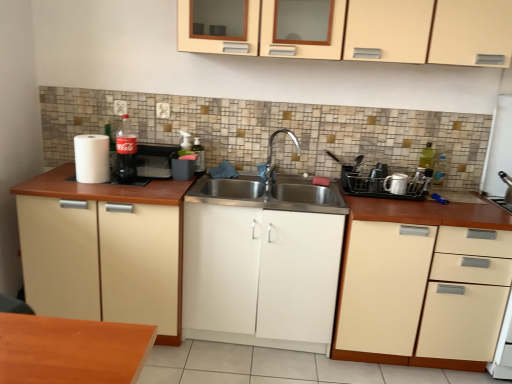
Describe the element at coordinates (271, 158) in the screenshot. The width and height of the screenshot is (512, 384). I see `polished stainless steel faucet at center` at that location.

The height and width of the screenshot is (384, 512). I want to click on white matte dish rack at center right, which appears as the 3th appliance when viewed from the right, so click(x=387, y=183).

What do you see at coordinates (396, 183) in the screenshot?
I see `white glossy mug at right, the first appliance from the right` at bounding box center [396, 183].

The width and height of the screenshot is (512, 384). What do you see at coordinates (103, 250) in the screenshot? I see `beige matte cabinet at left, acting as the 4th cabinetry starting from the right` at bounding box center [103, 250].

Measure the distance between white matte paper towel at left and camera.

The depth of white matte paper towel at left is 7.03 feet.

Identify the location of matte cream cabinet at upper center, the third cabinetry when ordered from left to right. This screenshot has height=384, width=512. (408, 32).

At what (x,y) coordinates should I click in order to perform the action: click on black plastic dish rack at right, which is the second appliance in right-to-left order. Please return your answer as a coordinate pair (x, y). This screenshot has height=384, width=512. Looking at the image, I should click on (377, 177).

Does matte glass coca-cola bottle at left, which is counted as the 2th bottle, starting from the back, have a larger size compared to white matte cabinet at center, the third cabinetry positioned from the right?

Actually, matte glass coca-cola bottle at left, which is counted as the 2th bottle, starting from the back, might be smaller than white matte cabinet at center, the third cabinetry positioned from the right.

From the picture: Is matte glass coca-cola bottle at left, arranged as the 1th bottle when viewed from the left, in front of or behind white matte cabinet at center, placed as the second cabinetry when sorted from left to right, in the image?

matte glass coca-cola bottle at left, arranged as the 1th bottle when viewed from the left, is behind white matte cabinet at center, placed as the second cabinetry when sorted from left to right.

Is white matte dish rack at center right, which appears as the 1th appliance when viewed from the left, oriented away from black plastic dish rack at right, which is the second appliance in left-to-right order?

That's right, white matte dish rack at center right, which appears as the 1th appliance when viewed from the left, is facing away from black plastic dish rack at right, which is the second appliance in left-to-right order.

Which is closer, (x=384, y=190) or (x=380, y=177)?

Point (x=384, y=190)

Which object is more forward, white matte dish rack at center right, which appears as the 1th appliance when viewed from the left, or black plastic dish rack at right, which is the second appliance in left-to-right order?

Positioned in front is white matte dish rack at center right, which appears as the 1th appliance when viewed from the left.

Is white matte dish rack at center right, which appears as the 1th appliance when viewed from the left, completely or partially outside of black plastic dish rack at right, which is the second appliance in left-to-right order?

white matte dish rack at center right, which appears as the 1th appliance when viewed from the left, lies outside black plastic dish rack at right, which is the second appliance in left-to-right order,'s area.

Considering the positions of objects beige matte cabinet at left, positioned as the 1th cabinetry in left-to-right order, and beige matte cabinet at right, placed as the first cabinetry when sorted from right to left, in the image provided, who is in front, beige matte cabinet at left, positioned as the 1th cabinetry in left-to-right order, or beige matte cabinet at right, placed as the first cabinetry when sorted from right to left,?

Positioned in front is beige matte cabinet at right, placed as the first cabinetry when sorted from right to left.

Looking at this image, considering the relative sizes of beige matte cabinet at left, positioned as the 1th cabinetry in left-to-right order, and beige matte cabinet at right, marked as the 4th cabinetry in a left-to-right arrangement, in the image provided, is beige matte cabinet at left, positioned as the 1th cabinetry in left-to-right order, taller than beige matte cabinet at right, marked as the 4th cabinetry in a left-to-right arrangement,?

Incorrect, the height of beige matte cabinet at left, positioned as the 1th cabinetry in left-to-right order, is not larger of that of beige matte cabinet at right, marked as the 4th cabinetry in a left-to-right arrangement.

Considering the positions of objects beige matte cabinet at left, acting as the 4th cabinetry starting from the right, and beige matte cabinet at right, placed as the first cabinetry when sorted from right to left, in the image provided, who is more to the left, beige matte cabinet at left, acting as the 4th cabinetry starting from the right, or beige matte cabinet at right, placed as the first cabinetry when sorted from right to left,?

From the viewer's perspective, beige matte cabinet at left, acting as the 4th cabinetry starting from the right, appears more on the left side.

Is polished stainless steel faucet at center positioned with its back to white matte paper towel at left?

That's not correct — polished stainless steel faucet at center is not looking away from white matte paper towel at left.

Is point (271, 151) closer to camera compared to point (105, 147)?

That is False.

Looking at this image, from a real-world perspective, is polished stainless steel faucet at center on white matte paper towel at left?

Indeed, from a real-world perspective, polished stainless steel faucet at center stands above white matte paper towel at left.

Which object is further away from the camera taking this photo, polished stainless steel faucet at center or white matte paper towel at left?

polished stainless steel faucet at center is more distant.

Which of these two, beige matte cabinet at left, acting as the 4th cabinetry starting from the right, or white glossy mug at right, the 3th appliance in the left-to-right sequence, is thinner?

white glossy mug at right, the 3th appliance in the left-to-right sequence, is thinner.

How many degrees apart are the facing directions of beige matte cabinet at left, acting as the 4th cabinetry starting from the right, and white glossy mug at right, the first appliance from the right?

There is a 7.26e-05-degree angle between the facing directions of beige matte cabinet at left, acting as the 4th cabinetry starting from the right, and white glossy mug at right, the first appliance from the right.

Would you consider beige matte cabinet at left, acting as the 4th cabinetry starting from the right, to be distant from white glossy mug at right, the 3th appliance in the left-to-right sequence?

Yes, beige matte cabinet at left, acting as the 4th cabinetry starting from the right, and white glossy mug at right, the 3th appliance in the left-to-right sequence, are located far from each other.

Does point (87, 192) appear closer or farther from the camera than point (392, 174)?

Point (87, 192) is closer to the camera than point (392, 174).

Considering the sizes of white matte cabinet at center, placed as the second cabinetry when sorted from left to right, and matte cream cabinet at upper center, the third cabinetry when ordered from left to right, in the image, is white matte cabinet at center, placed as the second cabinetry when sorted from left to right, taller or shorter than matte cream cabinet at upper center, the third cabinetry when ordered from left to right,?

In the image, white matte cabinet at center, placed as the second cabinetry when sorted from left to right, appears to be taller than matte cream cabinet at upper center, the third cabinetry when ordered from left to right.

Could you tell me if white matte cabinet at center, the third cabinetry positioned from the right, is facing matte cream cabinet at upper center, the third cabinetry when ordered from left to right?

No, white matte cabinet at center, the third cabinetry positioned from the right, is not aimed at matte cream cabinet at upper center, the third cabinetry when ordered from left to right.

Is point (290, 231) positioned after point (330, 56)?

Yes, point (290, 231) is behind point (330, 56).

Which is behind, white matte cabinet at center, the third cabinetry positioned from the right, or matte cream cabinet at upper center, acting as the second cabinetry starting from the right?

Positioned behind is white matte cabinet at center, the third cabinetry positioned from the right.

Between white matte dish rack at center right, which appears as the 1th appliance when viewed from the left, and translucent plastic soap dispenser at center, marked as the first bottle in a right-to-left arrangement, which one is positioned in front?

white matte dish rack at center right, which appears as the 1th appliance when viewed from the left, is closer to the camera.

Looking at this image, could you tell me if white matte dish rack at center right, which appears as the 3th appliance when viewed from the right, is turned towards translucent plastic soap dispenser at center, which is the second bottle from left to right?

No, white matte dish rack at center right, which appears as the 3th appliance when viewed from the right, is not facing towards translucent plastic soap dispenser at center, which is the second bottle from left to right.

Looking at this image, in terms of height, does white matte dish rack at center right, which appears as the 1th appliance when viewed from the left, look taller or shorter compared to translucent plastic soap dispenser at center, which appears as the 1th bottle when viewed from the back?

Considering their sizes, white matte dish rack at center right, which appears as the 1th appliance when viewed from the left, has less height than translucent plastic soap dispenser at center, which appears as the 1th bottle when viewed from the back.

Does point (399, 188) come closer to viewer compared to point (198, 146)?

Yes.

This screenshot has height=384, width=512. Find the location of `bottle that is the 2nd object above the white matte cabinet at center, placed as the second cabinetry when sorted from left to right (from a real-world perspective)`. bottle that is the 2nd object above the white matte cabinet at center, placed as the second cabinetry when sorted from left to right (from a real-world perspective) is located at coordinates (125, 153).

Where is `the 2nd appliance in front of the black plastic dish rack at right, which is the second appliance in right-to-left order, counting from the anchor's position`? This screenshot has width=512, height=384. the 2nd appliance in front of the black plastic dish rack at right, which is the second appliance in right-to-left order, counting from the anchor's position is located at coordinates (387, 183).

Looking at this image, from the image, which object appears to be farther from white matte paper towel at left, white matte cabinet at center, the third cabinetry positioned from the right, or matte glass coca-cola bottle at left, arranged as the 1th bottle when viewed from the left?

Among the two, white matte cabinet at center, the third cabinetry positioned from the right, is located further to white matte paper towel at left.

Looking at the image, which one is located further to polished stainless steel faucet at center, beige matte cabinet at right, placed as the first cabinetry when sorted from right to left, or matte glass coca-cola bottle at left, arranged as the 1th bottle when viewed from the left?

beige matte cabinet at right, placed as the first cabinetry when sorted from right to left, is positioned further to the anchor polished stainless steel faucet at center.

When comparing their distances from matte glass coca-cola bottle at left, the 1th bottle viewed from the front, does white matte paper towel at left or white matte dish rack at center right, which appears as the 3th appliance when viewed from the right, seem closer?

Based on the image, white matte paper towel at left appears to be nearer to matte glass coca-cola bottle at left, the 1th bottle viewed from the front.

From the picture: Estimate the real-world distances between objects in this image. Which object is closer to beige matte cabinet at right, placed as the first cabinetry when sorted from right to left, translucent plastic soap dispenser at center, which appears as the 1th bottle when viewed from the back, or matte glass coca-cola bottle at left, the 1th bottle viewed from the front?

translucent plastic soap dispenser at center, which appears as the 1th bottle when viewed from the back, lies closer to beige matte cabinet at right, placed as the first cabinetry when sorted from right to left, than the other object.

Estimate the real-world distances between objects in this image. Which object is further from matte cream cabinet at upper center, the third cabinetry when ordered from left to right, beige matte cabinet at left, positioned as the 1th cabinetry in left-to-right order, or polished stainless steel faucet at center?

Among the two, beige matte cabinet at left, positioned as the 1th cabinetry in left-to-right order, is located further to matte cream cabinet at upper center, the third cabinetry when ordered from left to right.

Based on their spatial positions, is translucent plastic soap dispenser at center, which is counted as the second bottle, starting from the front, or polished stainless steel faucet at center closer to white matte cabinet at center, placed as the second cabinetry when sorted from left to right?

polished stainless steel faucet at center.

From the image, which object appears to be farther from matte glass coca-cola bottle at left, arranged as the 1th bottle when viewed from the left, white glossy mug at right, the 3th appliance in the left-to-right sequence, or beige matte cabinet at left, acting as the 4th cabinetry starting from the right?

white glossy mug at right, the 3th appliance in the left-to-right sequence.

Looking at this image, estimate the real-world distances between objects in this image. Which object is closer to black plastic dish rack at right, which is the second appliance in left-to-right order, white matte paper towel at left or beige matte cabinet at left, positioned as the 1th cabinetry in left-to-right order?

Among the two, beige matte cabinet at left, positioned as the 1th cabinetry in left-to-right order, is located nearer to black plastic dish rack at right, which is the second appliance in left-to-right order.

Locate an element on the screen. The width and height of the screenshot is (512, 384). appliance between beige matte cabinet at left, acting as the 4th cabinetry starting from the right, and black plastic dish rack at right, which is the second appliance in right-to-left order is located at coordinates (387, 183).

Locate an element on the screen. This screenshot has height=384, width=512. tap situated between white matte paper towel at left and matte cream cabinet at upper center, the third cabinetry when ordered from left to right, from left to right is located at coordinates (271, 158).

At what (x,y) coordinates should I click in order to perform the action: click on tap located between white matte cabinet at center, placed as the second cabinetry when sorted from left to right, and white glossy mug at right, the first appliance from the right, in the left-right direction. Please return your answer as a coordinate pair (x, y). Image resolution: width=512 pixels, height=384 pixels. Looking at the image, I should click on (271, 158).

Where is `tap between matte cream cabinet at upper center, acting as the second cabinetry starting from the right, and beige matte cabinet at right, marked as the 4th cabinetry in a left-to-right arrangement, in the up-down direction`? The width and height of the screenshot is (512, 384). tap between matte cream cabinet at upper center, acting as the second cabinetry starting from the right, and beige matte cabinet at right, marked as the 4th cabinetry in a left-to-right arrangement, in the up-down direction is located at coordinates (271, 158).